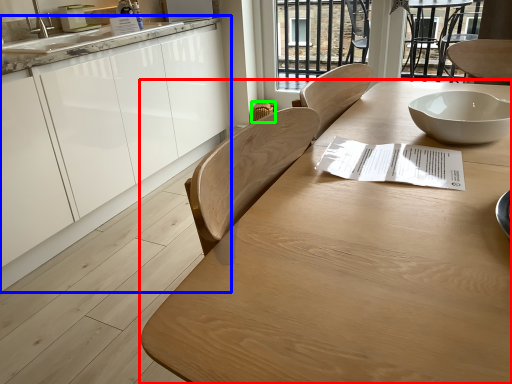
Question: Based on their relative distances, which object is nearer to table (highlighted by a red box)? Choose from cabinetry (highlighted by a blue box) and chair (highlighted by a green box).

Choices:
 (A) cabinetry
 (B) chair

Answer: (A)